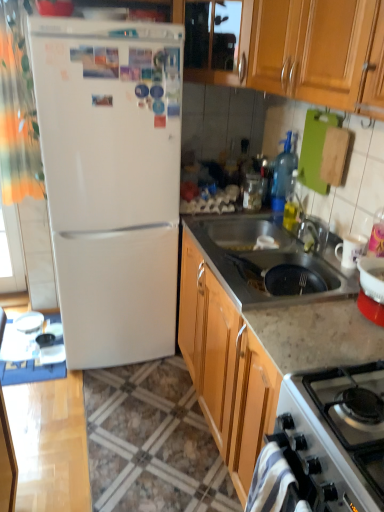
Find the location of a particular element. free space in front of white glossy refrigerator at left is located at coordinates (104, 403).